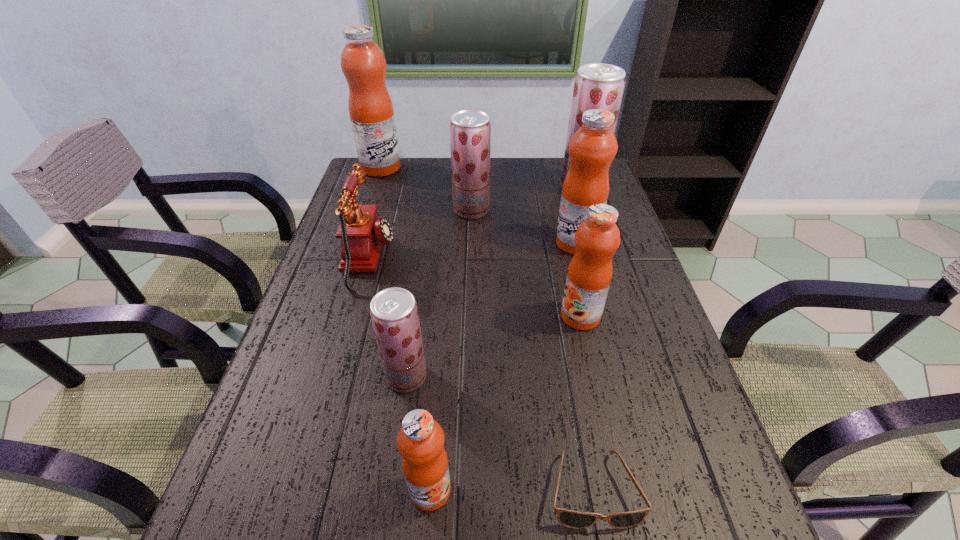
Where is `vacant space at the far edge of the desktop`? The image size is (960, 540). vacant space at the far edge of the desktop is located at coordinates click(497, 175).

Locate an element on the screen. free space at the left edge of the desktop is located at coordinates (334, 288).

This screenshot has width=960, height=540. Identify the location of free space at the right edge. (675, 356).

Identify the location of blank space at the far right corner of the desktop. The image size is (960, 540). (558, 160).

I want to click on vacant region between the telephone and the second nearest strawberry fruit juice, so click(420, 234).

You are a GUI agent. You are given a task and a screenshot of the screen. Output one action in this format:
    pyautogui.click(x=<x>, y=<y>)
    Task: Click on the free space between the sixth farthest object and the sunglasses
    This screenshot has height=540, width=960.
    Given the screenshot: What is the action you would take?
    pyautogui.click(x=587, y=402)

Locate an element on the screen. The width and height of the screenshot is (960, 540). empty location between the second nearest fruit juice and the fifth farthest fruit juice is located at coordinates (493, 346).

In order to click on free space between the second strawberry fruit juice from right to left and the leftmost strawberry fruit juice in this screenshot , I will do `click(439, 293)`.

This screenshot has height=540, width=960. What are the coordinates of `object that ranks as the closest to the second nearest fruit juice` in the screenshot? It's located at (420, 441).

Find the location of a particular element. The width and height of the screenshot is (960, 540). object that stands as the sixth closest to the telephone is located at coordinates (420, 441).